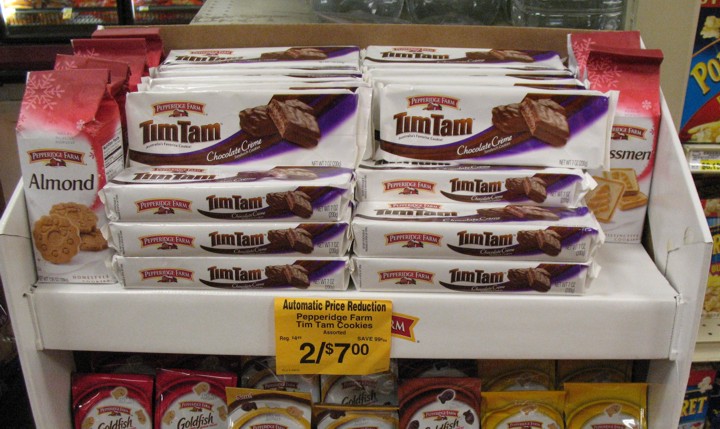
The width and height of the screenshot is (720, 429). I want to click on white shelf, so click(487, 359).